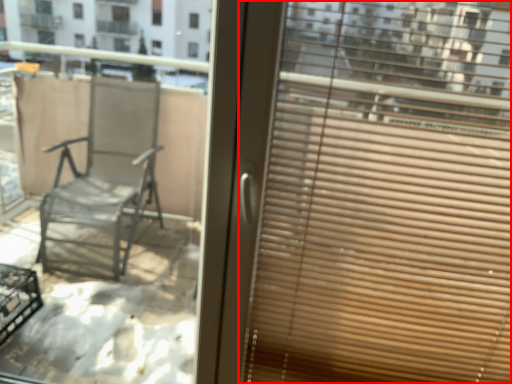
Question: Observing the image, what is the correct spatial positioning of window blind (annotated by the red box) in reference to window?

Choices:
 (A) right
 (B) left

Answer: (A)